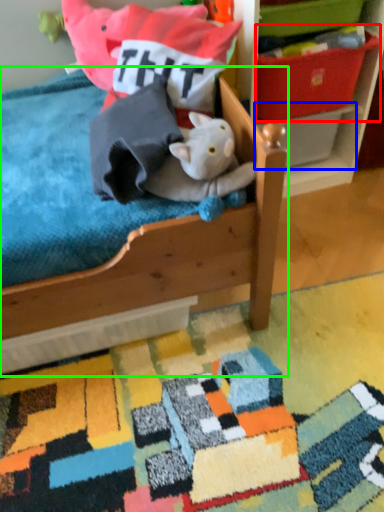
Question: Based on their relative distances, which object is farther from storage box (highlighted by a red box)? Choose from storage box (highlighted by a blue box) and furniture (highlighted by a green box).

Choices:
 (A) storage box
 (B) furniture

Answer: (B)